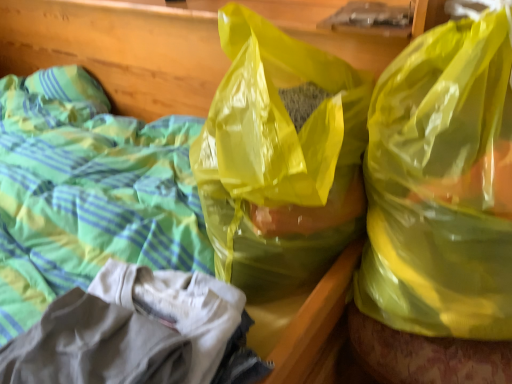
Question: From the image's perspective, would you say translucent yellow plastic bag at center, arranged as the 2th plastic bag when viewed from the right, is shown under yellow translucent plastic bag at upper right, which is the 1th plastic bag in right-to-left order?

Choices:
 (A) yes
 (B) no

Answer: (B)

Question: Considering the relative sizes of translucent yellow plastic bag at center, the first plastic bag from the left, and yellow translucent plastic bag at upper right, placed as the 2th plastic bag when sorted from left to right, in the image provided, is translucent yellow plastic bag at center, the first plastic bag from the left, taller than yellow translucent plastic bag at upper right, placed as the 2th plastic bag when sorted from left to right,?

Choices:
 (A) no
 (B) yes

Answer: (A)

Question: Could you tell me if translucent yellow plastic bag at center, arranged as the 2th plastic bag when viewed from the right, is facing yellow translucent plastic bag at upper right, placed as the 2th plastic bag when sorted from left to right?

Choices:
 (A) yes
 (B) no

Answer: (B)

Question: Considering the relative sizes of translucent yellow plastic bag at center, the first plastic bag from the left, and yellow translucent plastic bag at upper right, which is the 1th plastic bag in right-to-left order, in the image provided, is translucent yellow plastic bag at center, the first plastic bag from the left, shorter than yellow translucent plastic bag at upper right, which is the 1th plastic bag in right-to-left order,?

Choices:
 (A) yes
 (B) no

Answer: (A)

Question: Can you confirm if translucent yellow plastic bag at center, arranged as the 2th plastic bag when viewed from the right, is wider than yellow translucent plastic bag at upper right, which is the 1th plastic bag in right-to-left order?

Choices:
 (A) no
 (B) yes

Answer: (B)

Question: Does translucent yellow plastic bag at center, the first plastic bag from the left, have a smaller size compared to yellow translucent plastic bag at upper right, placed as the 2th plastic bag when sorted from left to right?

Choices:
 (A) no
 (B) yes

Answer: (A)

Question: Does yellow translucent plastic bag at upper right, placed as the 2th plastic bag when sorted from left to right, have a lesser height compared to translucent yellow plastic bag at center, arranged as the 2th plastic bag when viewed from the right?

Choices:
 (A) no
 (B) yes

Answer: (A)

Question: From the image's perspective, is yellow translucent plastic bag at upper right, which is the 1th plastic bag in right-to-left order, under translucent yellow plastic bag at center, arranged as the 2th plastic bag when viewed from the right?

Choices:
 (A) yes
 (B) no

Answer: (A)

Question: Does yellow translucent plastic bag at upper right, placed as the 2th plastic bag when sorted from left to right, have a lesser width compared to translucent yellow plastic bag at center, arranged as the 2th plastic bag when viewed from the right?

Choices:
 (A) yes
 (B) no

Answer: (A)

Question: Is yellow translucent plastic bag at upper right, which is the 1th plastic bag in right-to-left order, bigger than translucent yellow plastic bag at center, arranged as the 2th plastic bag when viewed from the right?

Choices:
 (A) no
 (B) yes

Answer: (A)

Question: Is yellow translucent plastic bag at upper right, placed as the 2th plastic bag when sorted from left to right, closer to camera compared to translucent yellow plastic bag at center, the first plastic bag from the left?

Choices:
 (A) no
 (B) yes

Answer: (B)

Question: From a real-world perspective, does yellow translucent plastic bag at upper right, which is the 1th plastic bag in right-to-left order, stand above translucent yellow plastic bag at center, the first plastic bag from the left?

Choices:
 (A) no
 (B) yes

Answer: (B)

Question: In the image, is translucent yellow plastic bag at center, arranged as the 2th plastic bag when viewed from the right, positioned in front of or behind yellow translucent plastic bag at upper right, which is the 1th plastic bag in right-to-left order?

Choices:
 (A) front
 (B) behind

Answer: (B)